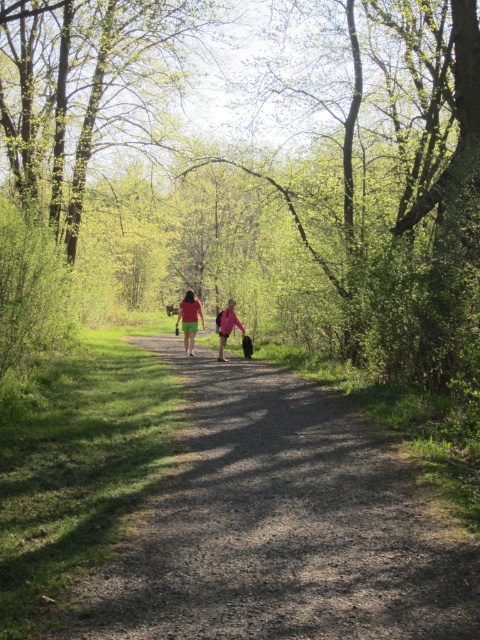
Who is lower down, green leafy tree at center or matte pink jacket at center?

matte pink jacket at center is below.

Locate an element on the screen. The width and height of the screenshot is (480, 640). green leafy tree at center is located at coordinates (x=263, y=170).

Find the location of a particular element. The height and width of the screenshot is (640, 480). green leafy tree at center is located at coordinates (263, 170).

Can you confirm if green leafy tree at center is wider than dirt path at center?

Yes, green leafy tree at center is wider than dirt path at center.

Who is more distant from viewer, (132,262) or (392,560)?

The point (132,262) is more distant.

Does point (113, 54) come closer to viewer compared to point (447, 536)?

No.

Image resolution: width=480 pixels, height=640 pixels. I want to click on green leafy tree at center, so click(263, 170).

Is green leafy tree at center taller than green fabric shirt at center?

Correct, green leafy tree at center is much taller as green fabric shirt at center.

Does green leafy tree at center appear over green fabric shirt at center?

Yes.

Describe the element at coordinates (263, 170) in the screenshot. I see `green leafy tree at center` at that location.

The height and width of the screenshot is (640, 480). I want to click on green leafy tree at center, so click(x=263, y=170).